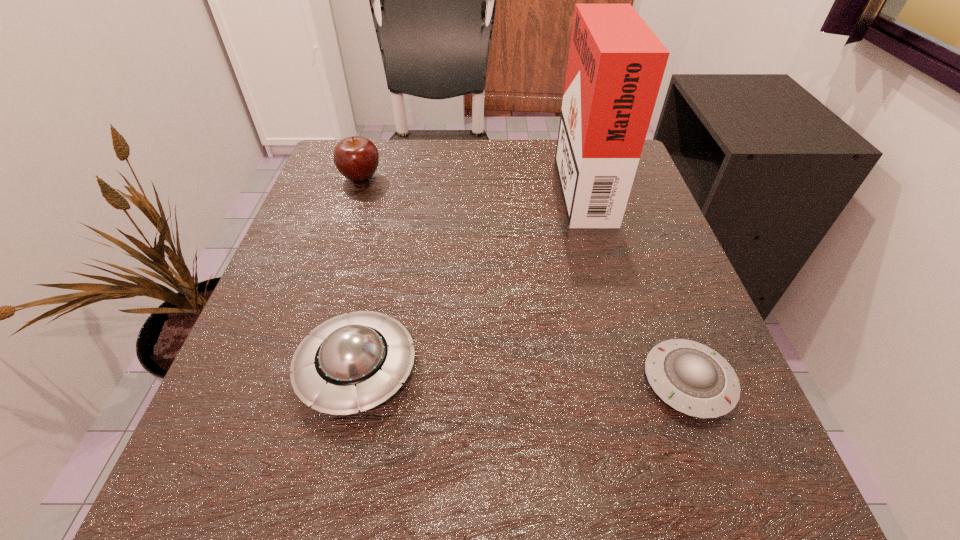
This screenshot has width=960, height=540. In order to click on vacant region at the far edge of the desktop in this screenshot , I will do `click(420, 153)`.

Locate an element on the screen. vacant space at the near edge is located at coordinates (391, 453).

This screenshot has height=540, width=960. What are the coordinates of `vacant area at the left edge` in the screenshot? It's located at (348, 215).

You are a GUI agent. You are given a task and a screenshot of the screen. Output one action in this format:
    pyautogui.click(x=<x>, y=<y>)
    Task: Click on the free point at the right edge
    The image size is (960, 540).
    Given the screenshot: What is the action you would take?
    pyautogui.click(x=715, y=427)

At what (x,y) coordinates should I click in order to perform the action: click on blank area at the far left corner. Please return your answer as a coordinate pair (x, y). Image resolution: width=960 pixels, height=540 pixels. Looking at the image, I should click on (391, 152).

At what (x,y) coordinates should I click in order to perform the action: click on free spot at the near left corner of the desktop. Please return your answer as a coordinate pair (x, y). Looking at the image, I should click on 228,503.

You are a GUI agent. You are given a task and a screenshot of the screen. Output one action in this format:
    pyautogui.click(x=<x>, y=<y>)
    Task: Click on the free space at the near right corner of the desktop
    The height and width of the screenshot is (540, 960).
    Given the screenshot: What is the action you would take?
    pyautogui.click(x=720, y=508)

The image size is (960, 540). I want to click on free space that is in between the shortest object and the second tallest object, so click(x=524, y=279).

Locate an element on the screen. The width and height of the screenshot is (960, 540). vacant area that lies between the right saucer and the third shortest object is located at coordinates (524, 279).

Identify the location of vacant area between the tallest object and the right saucer. (x=636, y=282).